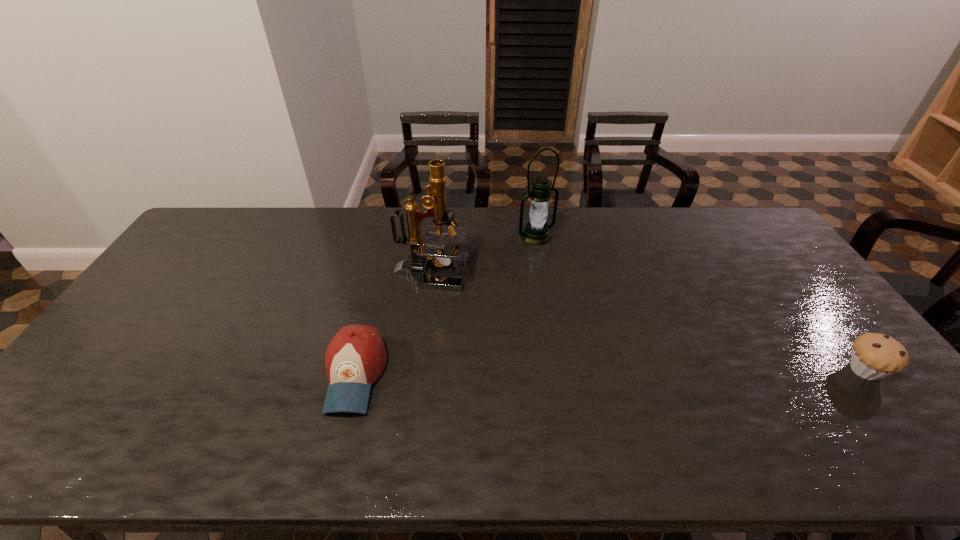
At what (x,y) coordinates should I click in order to perform the action: click on baseball cap. Please return your answer as a coordinate pair (x, y). Looking at the image, I should click on (356, 356).

The height and width of the screenshot is (540, 960). What are the coordinates of `muffin` in the screenshot? It's located at (874, 355).

Find the location of a particular element. Image resolution: width=960 pixels, height=540 pixels. microscope is located at coordinates (424, 250).

At what (x,y) coordinates should I click in order to perform the action: click on the second tallest object. Please return your answer as a coordinate pair (x, y). Looking at the image, I should click on (537, 232).

The image size is (960, 540). Identify the location of the farthest object. (537, 232).

Where is `vacant region located 0.290m on the back of the muffin`? Image resolution: width=960 pixels, height=540 pixels. vacant region located 0.290m on the back of the muffin is located at coordinates (795, 281).

You are a GUI agent. You are given a task and a screenshot of the screen. Output one action in this format:
    pyautogui.click(x=<x>, y=<y>)
    Task: Click on the free space located at the eyepiece of the third nearest object
    
    Given the screenshot: What is the action you would take?
    pyautogui.click(x=540, y=313)

You are a GUI agent. You are given a task and a screenshot of the screen. Output one action in this format:
    pyautogui.click(x=<x>, y=<y>)
    Task: Click on the vacant area situated 0.070m at the eyepiece of the third nearest object
    Image resolution: width=960 pixels, height=540 pixels.
    Given the screenshot: What is the action you would take?
    pyautogui.click(x=482, y=290)

This screenshot has height=540, width=960. I want to click on vacant area located at the eyepiece of the third nearest object, so click(x=525, y=307).

The height and width of the screenshot is (540, 960). What are the coordinates of `free space located on the side where the second object from right to left emits light` in the screenshot? It's located at (569, 268).